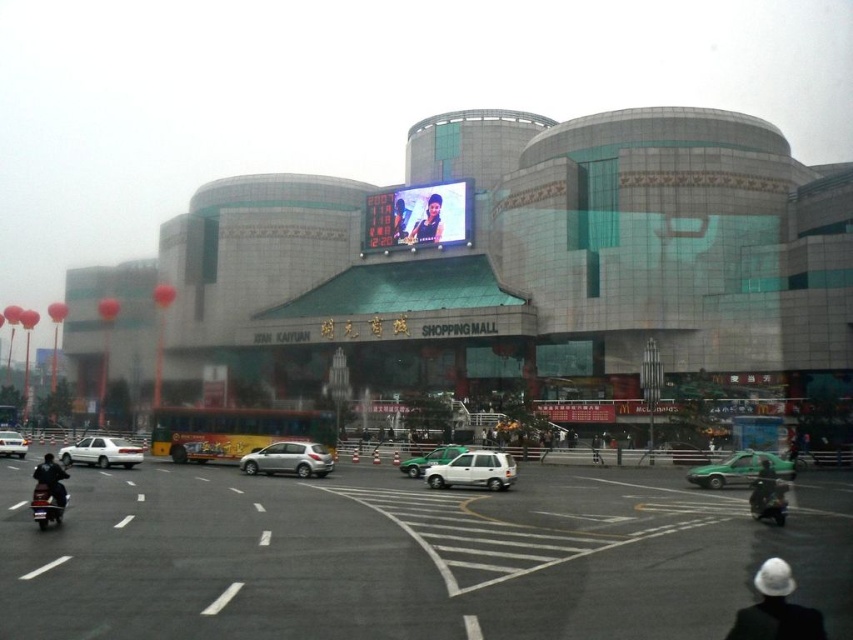
Between glassy gray building at center and dark green helmet at lower right, which one has more height?

With more height is glassy gray building at center.

Which is more to the left, glassy gray building at center or dark green helmet at lower right?

glassy gray building at center is more to the left.

This screenshot has width=853, height=640. I want to click on glassy gray building at center, so click(495, 275).

Does glassy gray building at center have a lesser height compared to satin silver hatchback at center?

Incorrect, glassy gray building at center's height does not fall short of satin silver hatchback at center's.

Between glassy gray building at center and satin silver hatchback at center, which one appears on the right side from the viewer's perspective?

satin silver hatchback at center

Between point (138, 365) and point (303, 451), which one is positioned in front?

Positioned in front is point (303, 451).

Identify the location of glassy gray building at center. (495, 275).

Does dark blue leather jacket at lower left appear on the right side of smooth skin face at center?

In fact, dark blue leather jacket at lower left is to the left of smooth skin face at center.

The width and height of the screenshot is (853, 640). Describe the element at coordinates (51, 477) in the screenshot. I see `dark blue leather jacket at lower left` at that location.

Is point (38, 476) positioned in front of point (407, 211)?

Yes, point (38, 476) is closer to viewer.

The width and height of the screenshot is (853, 640). In order to click on dark blue leather jacket at lower left in this screenshot , I will do `click(51, 477)`.